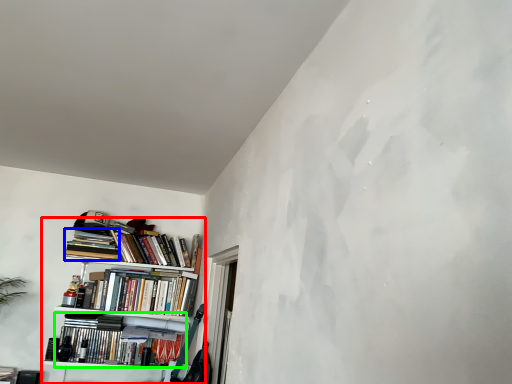
Question: Considering the real-world distances, which object is farthest from bookcase (highlighted by a red box)? book (highlighted by a blue box) or book (highlighted by a green box)?

Choices:
 (A) book
 (B) book

Answer: (A)